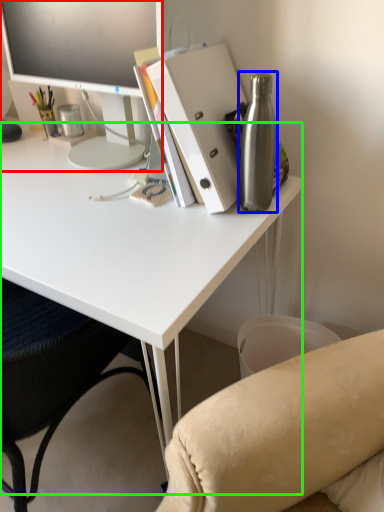
Question: Considering the real-world distances, which object is farthest from television (highlighted by a red box)? bottle (highlighted by a blue box) or desk (highlighted by a green box)?

Choices:
 (A) bottle
 (B) desk

Answer: (A)